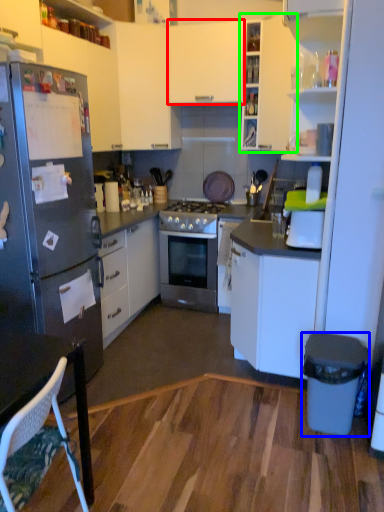
Question: Based on their relative distances, which object is nearer to cabinetry (highlighted by a red box)? Choose from trash bin/can (highlighted by a blue box) and cabinetry (highlighted by a green box).

Choices:
 (A) trash bin/can
 (B) cabinetry

Answer: (B)